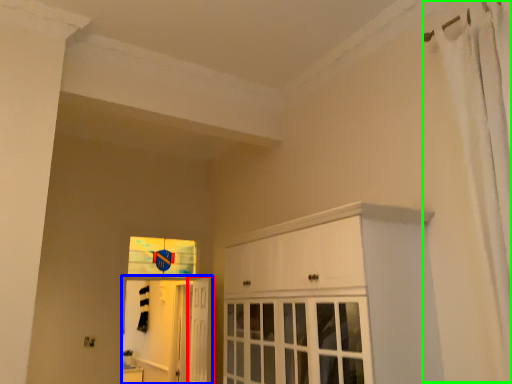
Question: Considering the real-world distances, which object is closest to door (highlighted by a red box)? elevator (highlighted by a blue box) or shower curtain (highlighted by a green box).

Choices:
 (A) elevator
 (B) shower curtain

Answer: (A)